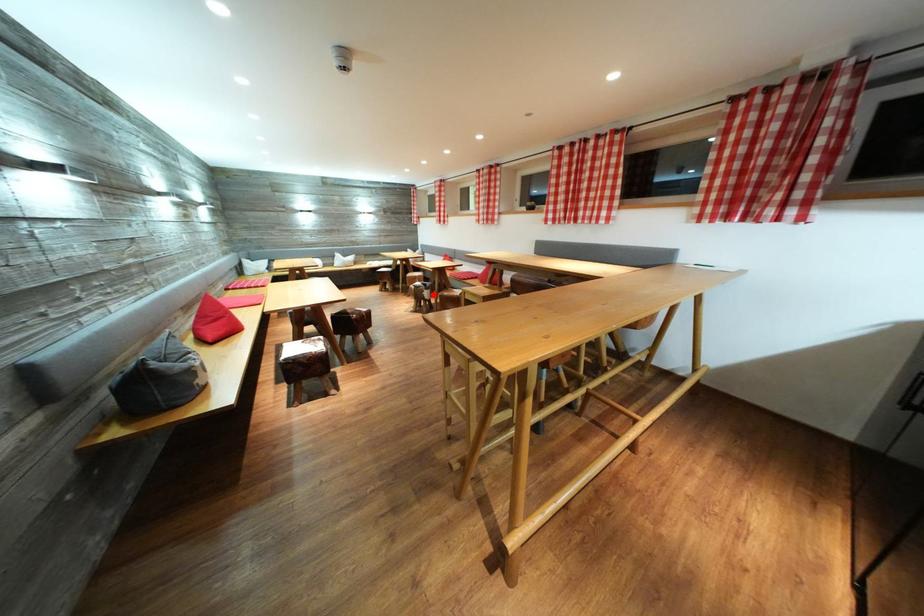
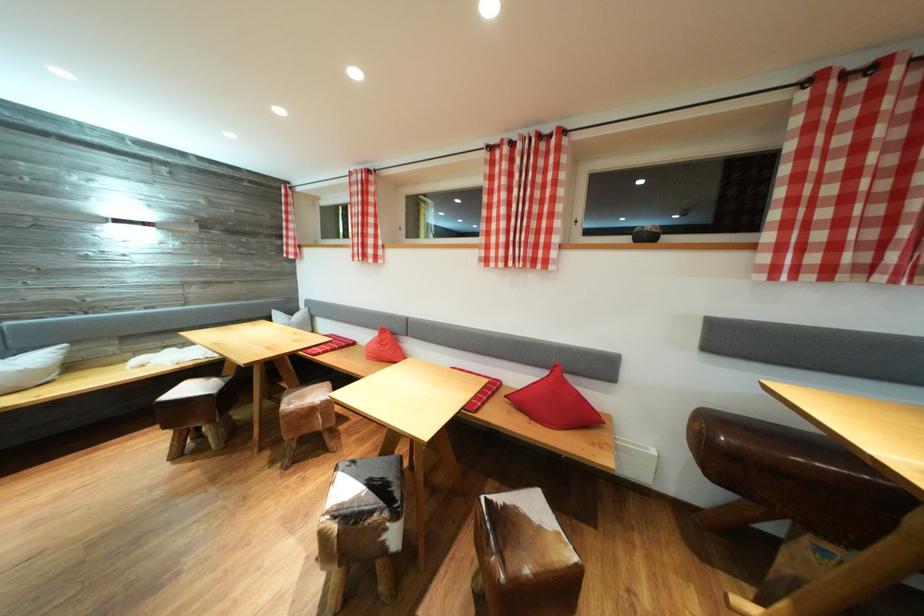
Question: A red point is marked in image1. In image2, is the corresponding 3D point closer to the camera or farther? Reply with the corresponding letter.

Choices:
 (A) The corresponding 3D point is closer.
 (B) The corresponding 3D point is farther.

Answer: (B)